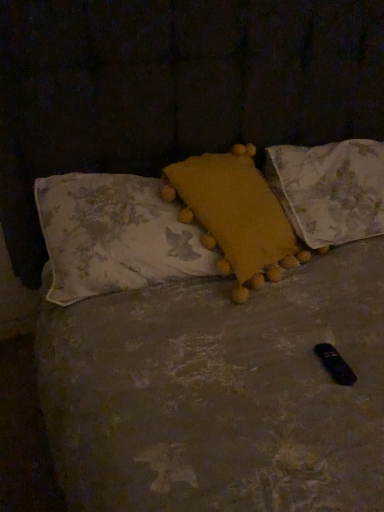
Question: From the image's perspective, is fluffy yellow pillow at center, which is the 3th pillow from right to left, on yellow fabric pillow at upper right, which is the first pillow from right to left?

Choices:
 (A) no
 (B) yes

Answer: (A)

Question: Can you confirm if fluffy yellow pillow at center, which is the 3th pillow from right to left, is smaller than yellow fabric pillow at upper right, arranged as the 3th pillow when viewed from the left?

Choices:
 (A) no
 (B) yes

Answer: (B)

Question: Is fluffy yellow pillow at center, which is the first pillow from left to right, in front of yellow fabric pillow at upper right, which is the first pillow from right to left?

Choices:
 (A) no
 (B) yes

Answer: (B)

Question: Does fluffy yellow pillow at center, which is the first pillow from left to right, have a lesser width compared to yellow fabric pillow at upper right, which is the first pillow from right to left?

Choices:
 (A) yes
 (B) no

Answer: (A)

Question: Considering the relative sizes of fluffy yellow pillow at center, which is the first pillow from left to right, and yellow fabric pillow at upper right, arranged as the 3th pillow when viewed from the left, in the image provided, is fluffy yellow pillow at center, which is the first pillow from left to right, shorter than yellow fabric pillow at upper right, arranged as the 3th pillow when viewed from the left,?

Choices:
 (A) yes
 (B) no

Answer: (A)

Question: Considering the relative sizes of fluffy yellow pillow at center, which is the 3th pillow from right to left, and yellow fabric pillow at upper right, arranged as the 3th pillow when viewed from the left, in the image provided, is fluffy yellow pillow at center, which is the 3th pillow from right to left, taller than yellow fabric pillow at upper right, arranged as the 3th pillow when viewed from the left,?

Choices:
 (A) yes
 (B) no

Answer: (B)

Question: Considering the relative sizes of yellow fuzzy pillow at center, the second pillow in the left-to-right sequence, and yellow fabric pillow at upper right, arranged as the 3th pillow when viewed from the left, in the image provided, is yellow fuzzy pillow at center, the second pillow in the left-to-right sequence, bigger than yellow fabric pillow at upper right, arranged as the 3th pillow when viewed from the left,?

Choices:
 (A) yes
 (B) no

Answer: (B)

Question: From a real-world perspective, is yellow fuzzy pillow at center, the second pillow in the left-to-right sequence, below yellow fabric pillow at upper right, which is the first pillow from right to left?

Choices:
 (A) no
 (B) yes

Answer: (A)

Question: Is yellow fuzzy pillow at center, marked as the second pillow in a right-to-left arrangement, behind yellow fabric pillow at upper right, which is the first pillow from right to left?

Choices:
 (A) no
 (B) yes

Answer: (A)

Question: From the image's perspective, is yellow fuzzy pillow at center, marked as the second pillow in a right-to-left arrangement, located above yellow fabric pillow at upper right, which is the first pillow from right to left?

Choices:
 (A) no
 (B) yes

Answer: (A)

Question: From a real-world perspective, is yellow fuzzy pillow at center, marked as the second pillow in a right-to-left arrangement, positioned over yellow fabric pillow at upper right, which is the first pillow from right to left, based on gravity?

Choices:
 (A) no
 (B) yes

Answer: (B)

Question: Does yellow fuzzy pillow at center, the second pillow in the left-to-right sequence, have a smaller size compared to yellow fabric pillow at upper right, which is the first pillow from right to left?

Choices:
 (A) no
 (B) yes

Answer: (B)

Question: Considering the relative sizes of yellow fabric pillow at upper right, arranged as the 3th pillow when viewed from the left, and yellow fuzzy pillow at center, marked as the second pillow in a right-to-left arrangement, in the image provided, is yellow fabric pillow at upper right, arranged as the 3th pillow when viewed from the left, smaller than yellow fuzzy pillow at center, marked as the second pillow in a right-to-left arrangement,?

Choices:
 (A) yes
 (B) no

Answer: (B)